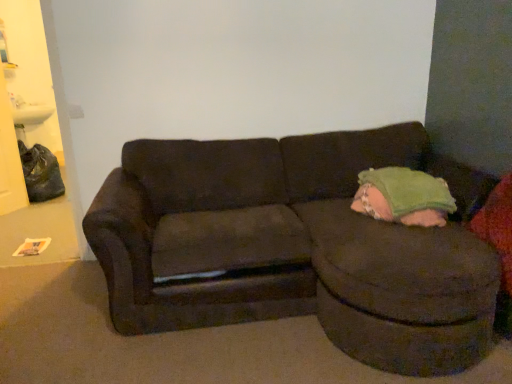
Question: Can you confirm if soft pink blanket at right is smaller than dark brown fabric studio couch at center?

Choices:
 (A) no
 (B) yes

Answer: (B)

Question: Is soft pink blanket at right bigger than dark brown fabric studio couch at center?

Choices:
 (A) no
 (B) yes

Answer: (A)

Question: Considering the relative sizes of soft pink blanket at right and dark brown fabric studio couch at center in the image provided, is soft pink blanket at right thinner than dark brown fabric studio couch at center?

Choices:
 (A) no
 (B) yes

Answer: (B)

Question: Is soft pink blanket at right positioned with its back to dark brown fabric studio couch at center?

Choices:
 (A) no
 (B) yes

Answer: (B)

Question: Is soft pink blanket at right placed right next to dark brown fabric studio couch at center?

Choices:
 (A) yes
 (B) no

Answer: (B)

Question: Is soft pink blanket at right at the right side of dark brown fabric studio couch at center?

Choices:
 (A) no
 (B) yes

Answer: (B)

Question: Is dark brown fabric studio couch at center aimed at soft pink blanket at right?

Choices:
 (A) yes
 (B) no

Answer: (A)

Question: Is dark brown fabric studio couch at center bigger than soft pink blanket at right?

Choices:
 (A) no
 (B) yes

Answer: (B)

Question: From a real-world perspective, is dark brown fabric studio couch at center located higher than soft pink blanket at right?

Choices:
 (A) yes
 (B) no

Answer: (B)

Question: Are dark brown fabric studio couch at center and soft pink blanket at right beside each other?

Choices:
 (A) yes
 (B) no

Answer: (B)

Question: From the image's perspective, is dark brown fabric studio couch at center above soft pink blanket at right?

Choices:
 (A) no
 (B) yes

Answer: (A)

Question: From the image's perspective, does dark brown fabric studio couch at center appear lower than soft pink blanket at right?

Choices:
 (A) no
 (B) yes

Answer: (B)

Question: Does point (105, 210) appear closer or farther from the camera than point (429, 185)?

Choices:
 (A) farther
 (B) closer

Answer: (B)